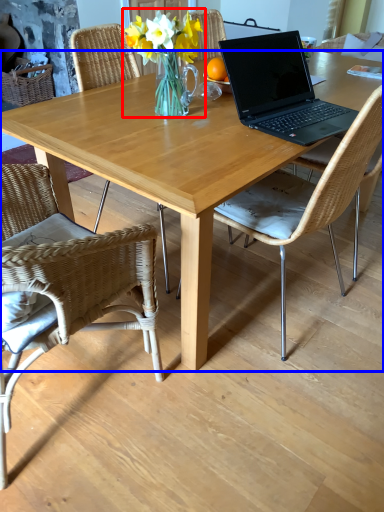
Question: Which of the following is the closest to the observer, floral arrangement (highlighted by a red box) or desk (highlighted by a blue box)?

Choices:
 (A) floral arrangement
 (B) desk

Answer: (B)